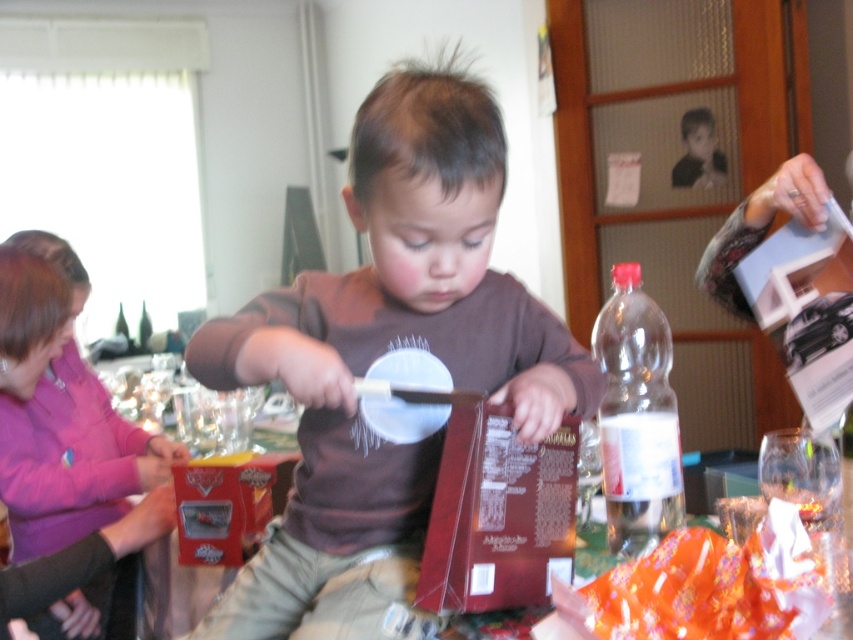
Does clear plastic bottle at right appear over clear plastic bottle at center?

Yes, clear plastic bottle at right is above clear plastic bottle at center.

Which is behind, point (631, 380) or point (659, 417)?

The point (631, 380) is behind.

Is point (651, 472) in front of point (610, 518)?

Yes, it is.

This screenshot has width=853, height=640. In order to click on clear plastic bottle at right in this screenshot , I will do `click(636, 417)`.

Is brown matte shirt at center to the right of clear plastic bottle at center from the viewer's perspective?

Incorrect, brown matte shirt at center is not on the right side of clear plastic bottle at center.

Who is lower down, brown matte shirt at center or clear plastic bottle at center?

clear plastic bottle at center is lower down.

Which is behind, point (299, 618) or point (648, 500)?

The point (648, 500) is behind.

Find the location of a particular element. Image resolution: width=853 pixels, height=640 pixels. brown matte shirt at center is located at coordinates (383, 355).

The width and height of the screenshot is (853, 640). I want to click on clear plastic bottle at center, so click(640, 477).

Between point (654, 468) and point (146, 314), which one is positioned in front?

Positioned in front is point (654, 468).

Which is in front, point (643, 465) or point (142, 330)?

Point (643, 465)

At what (x,y) coordinates should I click in order to perform the action: click on clear plastic bottle at center. Please return your answer as a coordinate pair (x, y). Image resolution: width=853 pixels, height=640 pixels. Looking at the image, I should click on (640, 477).